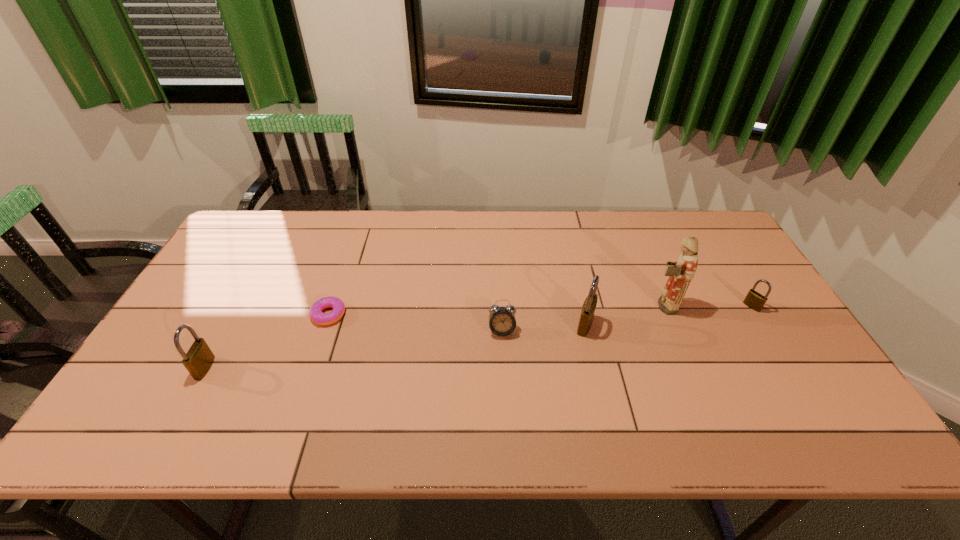
I want to click on unoccupied area between the nearest object and the fourth object from right to left, so click(353, 349).

Locate an element on the screen. The image size is (960, 540). free space between the nearest object and the shortest object is located at coordinates (267, 341).

You are a GUI agent. You are given a task and a screenshot of the screen. Output one action in this format:
    pyautogui.click(x=<x>, y=<y>)
    Task: Click on the unoccupied position between the alarm clock and the rightmost object
    
    Given the screenshot: What is the action you would take?
    pyautogui.click(x=627, y=319)

Where is `free area in between the leftmost padlock and the rightmost padlock`? free area in between the leftmost padlock and the rightmost padlock is located at coordinates click(x=478, y=337).

The width and height of the screenshot is (960, 540). I want to click on free space between the fourth object from right to left and the nearest object, so click(x=353, y=349).

Locate an element on the screen. The height and width of the screenshot is (540, 960). object that is the second closest one to the rightmost padlock is located at coordinates (588, 309).

Where is `object that is the fifth closest to the nearest padlock`? The width and height of the screenshot is (960, 540). object that is the fifth closest to the nearest padlock is located at coordinates (754, 300).

Point out which padlock is positioned as the third nearest to the doughnut. Please provide its 2D coordinates. Your answer should be formatted as a tuple, i.e. [(x, y)], where the tuple contains the x and y coordinates of a point satisfying the conditions above.

[(754, 300)]

Identify which padlock is the second closest to the rightmost object. Please provide its 2D coordinates. Your answer should be formatted as a tuple, i.e. [(x, y)], where the tuple contains the x and y coordinates of a point satisfying the conditions above.

[(198, 360)]

Find the location of a particular element. Image resolution: width=960 pixels, height=540 pixels. free point that satisfies the following two spatial constraints: 1. on the back side of the rightmost padlock; 2. on the front-facing side of the fifth object from left to right is located at coordinates (751, 306).